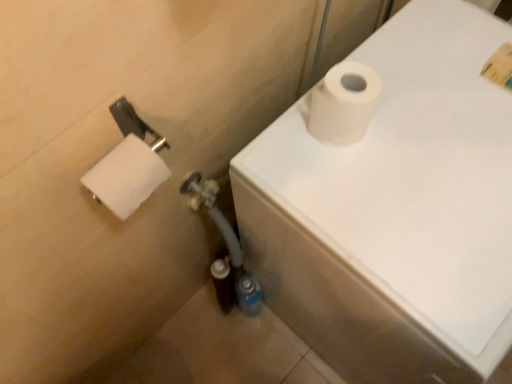
What are the coordinates of `vacant area that is in front of white matte toilet paper at upper right, acting as the first toilet paper starting from the right` in the screenshot? It's located at (367, 205).